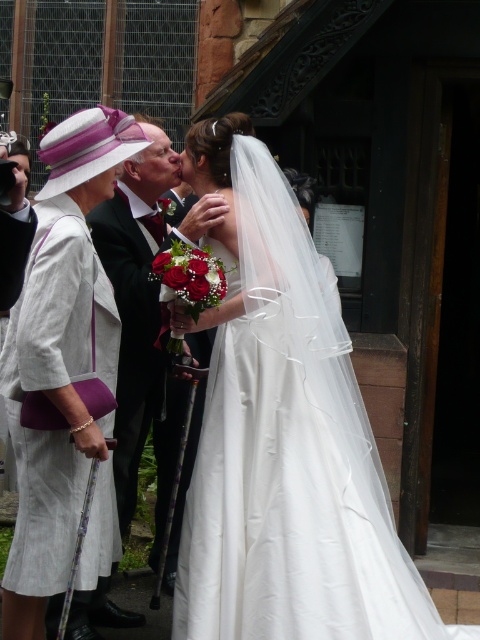
Is white satin dress at center smaller than white linen dress at left?

No.

Does white satin dress at center have a larger size compared to white linen dress at left?

Yes, white satin dress at center is bigger than white linen dress at left.

Is point (327, 609) positioned before point (85, 467)?

Yes, it is in front of point (85, 467).

The width and height of the screenshot is (480, 640). Find the location of `white satin dress at center`. white satin dress at center is located at coordinates (284, 436).

Consider the image. Does white satin dress at center have a greater width compared to black satin suit at center?

Indeed, white satin dress at center has a greater width compared to black satin suit at center.

Which is above, white satin dress at center or black satin suit at center?

black satin suit at center

Which is in front, point (253, 600) or point (137, 416)?

Point (253, 600) is more forward.

At what (x,y) coordinates should I click in order to perform the action: click on white satin dress at center. Please return your answer as a coordinate pair (x, y). The image size is (480, 640). Looking at the image, I should click on (284, 436).

Does white linen dress at left have a greater height compared to black satin suit at center?

No.

Can you confirm if white linen dress at left is positioned to the right of black satin suit at center?

Incorrect, white linen dress at left is not on the right side of black satin suit at center.

What do you see at coordinates (54, 387) in the screenshot?
I see `white linen dress at left` at bounding box center [54, 387].

Where is `white linen dress at left`? The height and width of the screenshot is (640, 480). white linen dress at left is located at coordinates (54, 387).